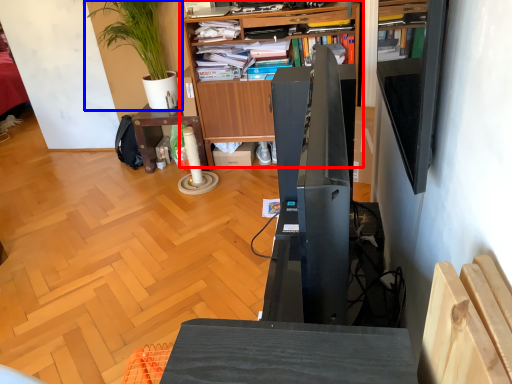
Question: Which object appears farthest to the camera in this image, bookcase (highlighted by a red box) or houseplant (highlighted by a blue box)?

Choices:
 (A) bookcase
 (B) houseplant

Answer: (B)